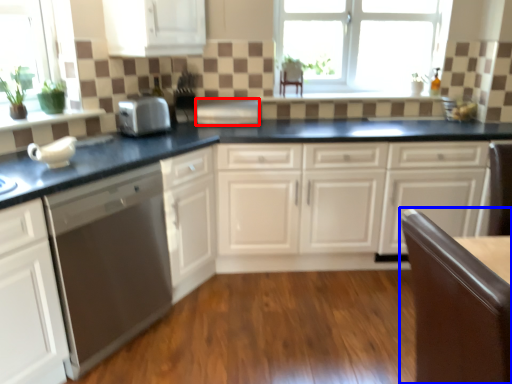
Question: Which object is closer to the camera taking this photo, appliance (highlighted by a red box) or chair (highlighted by a blue box)?

Choices:
 (A) appliance
 (B) chair

Answer: (B)